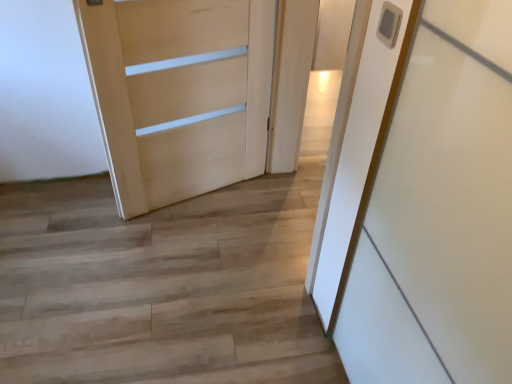
Find the location of a particular element. vacant region in front of light wood door at center, which is the first door in left-to-right order is located at coordinates (182, 259).